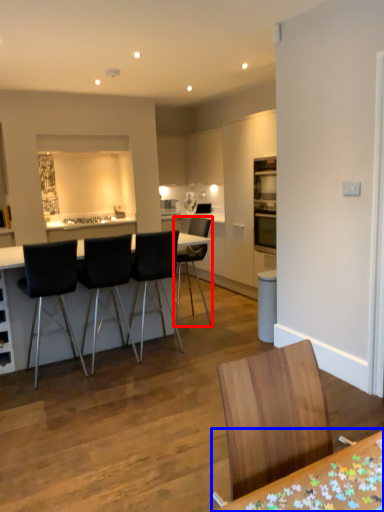
Question: Which object appears closest to the camera in this image, chair (highlighted by a red box) or table (highlighted by a blue box)?

Choices:
 (A) chair
 (B) table

Answer: (B)